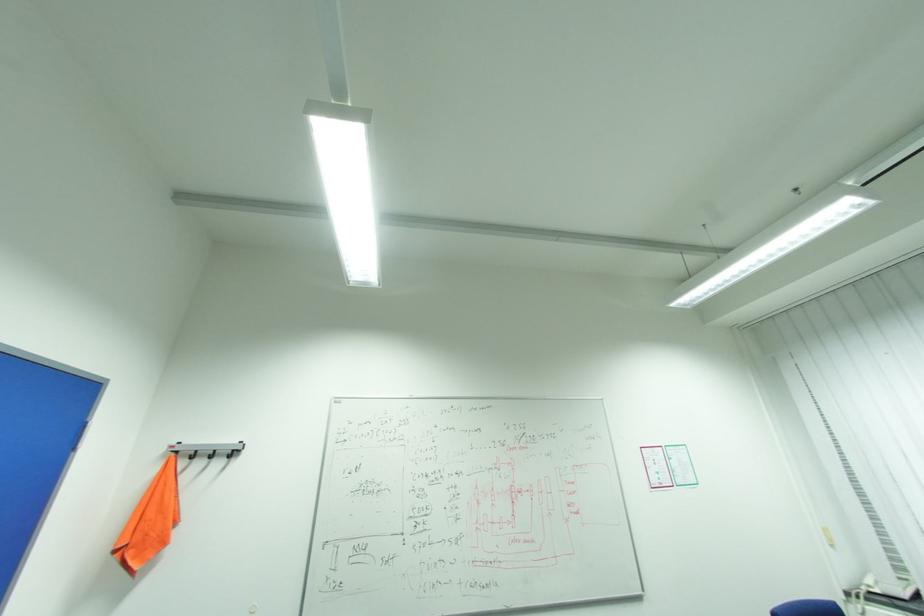
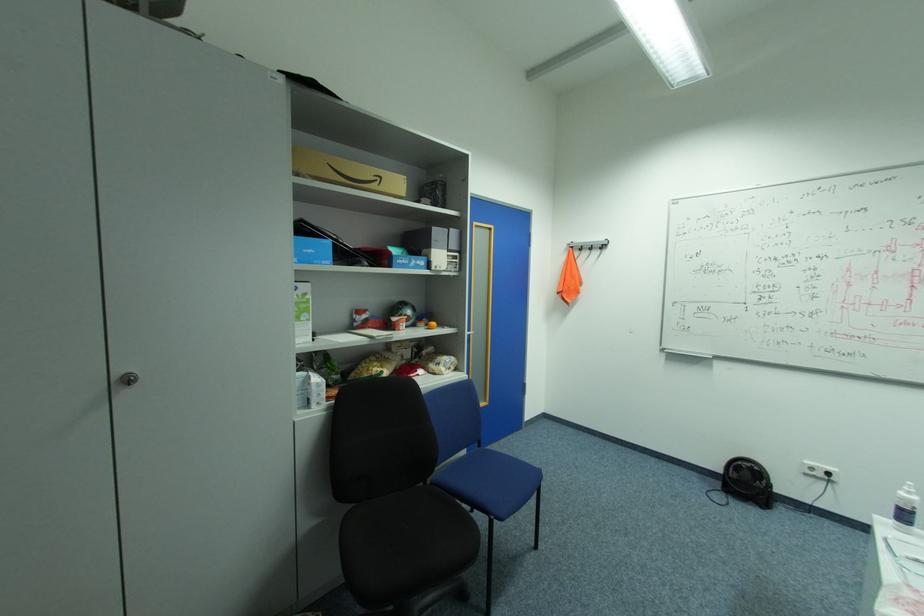
In the second image, find the point that corresponds to point 237,453 in the first image.

(608, 246)